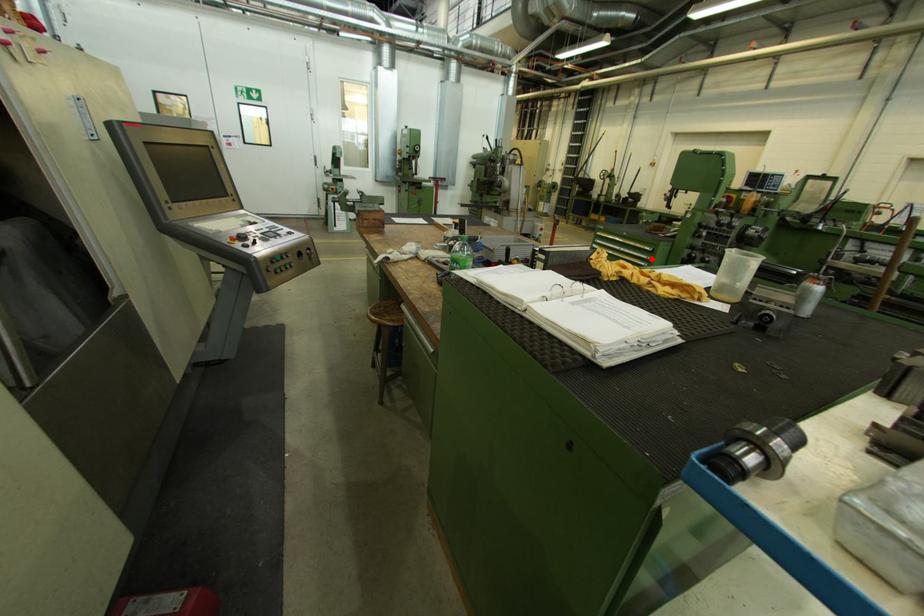
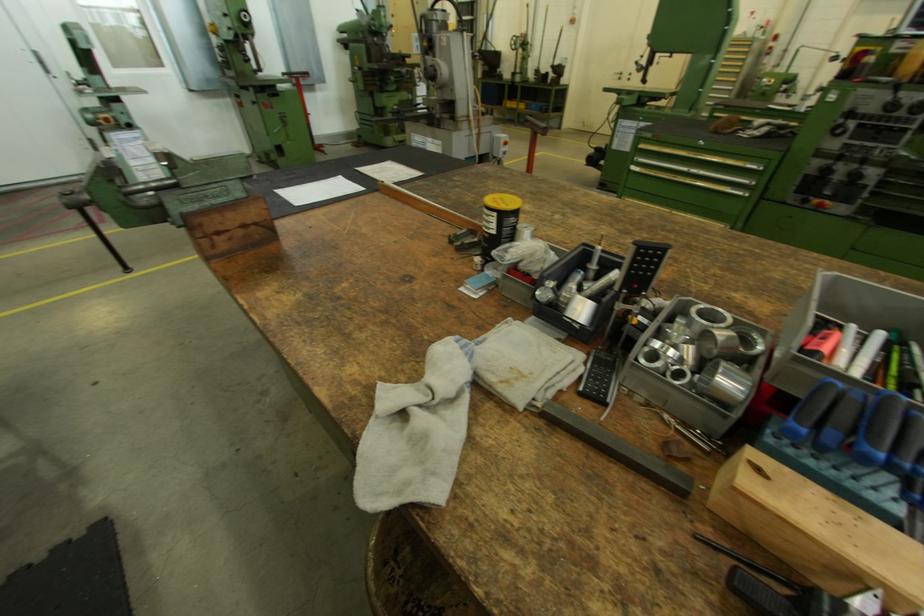
The point at the highlighted location is marked in the first image. Where is the corresponding point in the second image?

(752, 183)